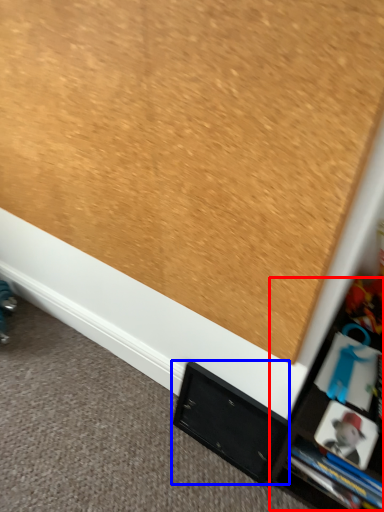
Question: Which object appears farthest to the camera in this image, tv cabinet (highlighted by a red box) or cabinet (highlighted by a blue box)?

Choices:
 (A) tv cabinet
 (B) cabinet

Answer: (B)